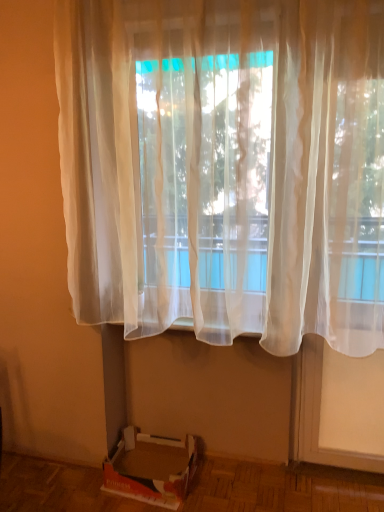
Question: Considering the positions of cardboard box at lower left and translucent white curtain at center in the image, is cardboard box at lower left bigger or smaller than translucent white curtain at center?

Choices:
 (A) small
 (B) big

Answer: (A)

Question: Does point (165, 453) appear closer or farther from the camera than point (309, 60)?

Choices:
 (A) farther
 (B) closer

Answer: (A)

Question: Which is correct: cardboard box at lower left is inside translucent white curtain at center, or outside of it?

Choices:
 (A) inside
 (B) outside

Answer: (B)

Question: Is translucent white curtain at center wider or thinner than cardboard box at lower left?

Choices:
 (A) thin
 (B) wide

Answer: (A)

Question: Which is correct: translucent white curtain at center is inside cardboard box at lower left, or outside of it?

Choices:
 (A) outside
 (B) inside

Answer: (A)

Question: Considering the positions of point (357, 41) and point (196, 458), is point (357, 41) closer or farther from the camera than point (196, 458)?

Choices:
 (A) closer
 (B) farther

Answer: (A)

Question: From a real-world perspective, relative to cardboard box at lower left, is translucent white curtain at center vertically above or below?

Choices:
 (A) above
 (B) below

Answer: (A)